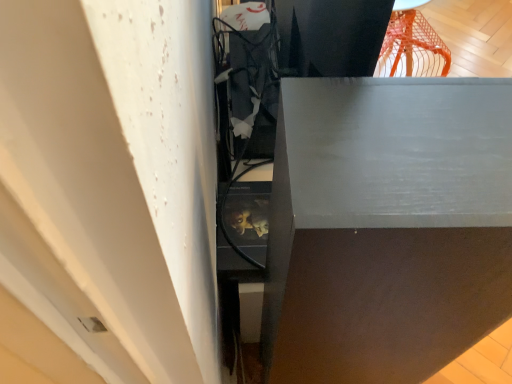
This screenshot has height=384, width=512. What do you see at coordinates (386, 227) in the screenshot?
I see `satin silver frame at center` at bounding box center [386, 227].

You are a GUI agent. You are given a task and a screenshot of the screen. Output one action in this format:
    pyautogui.click(x=<x>, y=<y>)
    Task: Click on the satin silver frame at center
    
    Given the screenshot: What is the action you would take?
    click(386, 227)

At what (x,y) coordinates should I click in order to perform the action: click on satin silver frame at center. Please return your answer as a coordinate pair (x, y). Looking at the image, I should click on (386, 227).